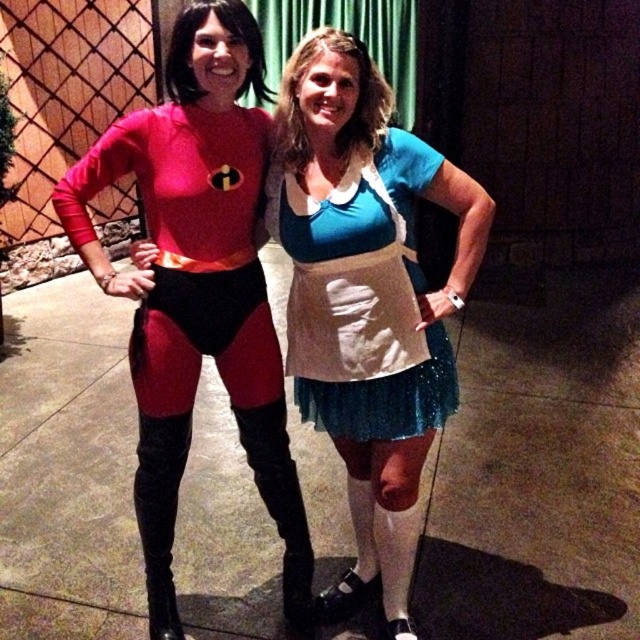
You are a photographer setting up a camera at the origin point of the coordinate system. The camera can only focus on objects within a radius of 0.5 units. Is the blue satin dress at center within the camera focus range?

The blue satin dress at center is at point (365, 298). The distance from the origin to this point is sqrt0.466 squared plus 0.573 squared equals approximately 0.738 units, which exceeds the camera focus range of 0.5 units. Therefore, the blue satin dress at center is outside the focus range.

You are a photographer standing in front of the blue satin dress at center. You want to take a closeup shot of the dress while keeping the background slightly blurred. If your camera requires the subject to be within 1.5 meters for optimal focus, will you need to move closer or farther away?

The blue satin dress at center is 1.60 meters away from the camera. Since the camera requires the subject to be within 1.5 meters for optimal focus, you need to move closer to the blue satin dress at center to achieve the desired focus and blur the background.

You are a photographer setting up for a photoshoot and need to position a spotlight. The scene has a blue satin dress at center and a shiny spandex suit at left. Which object should you focus the spotlight on to capture the reflection better, and why?

The shiny spandex suit at left should be focused on because it has a reflective surface that would produce better reflections compared to the blue satin dress at center.